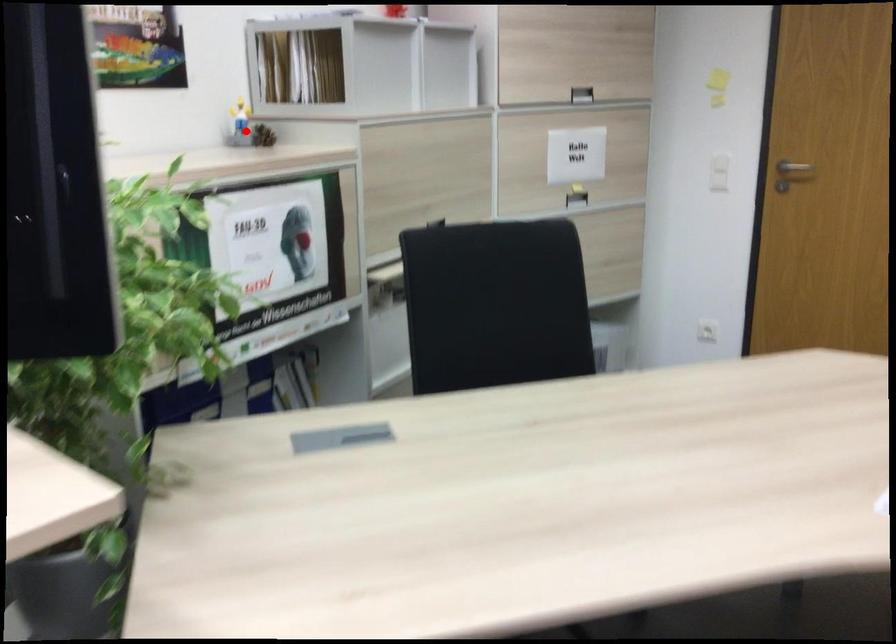
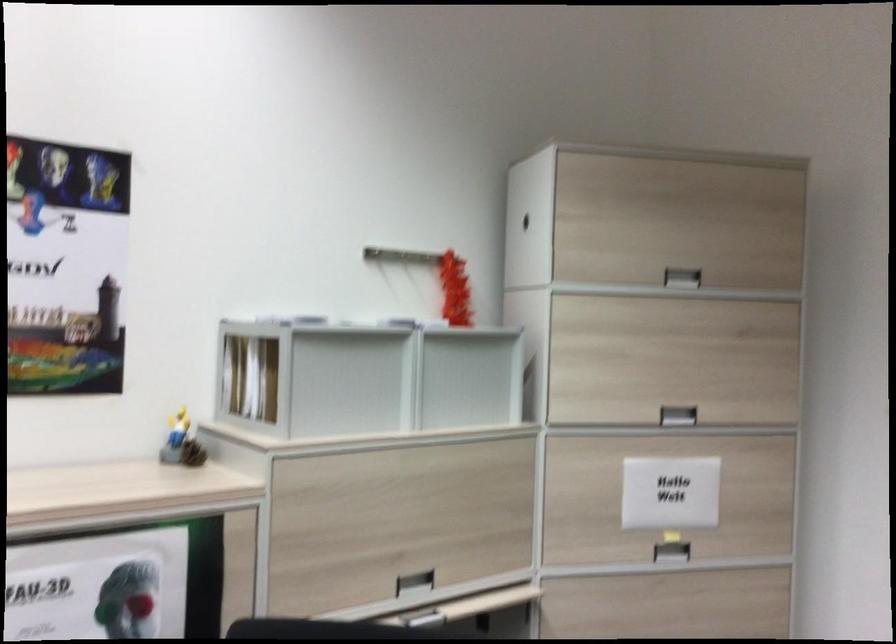
The point at the highlighted location is marked in the first image. Where is the corresponding point in the second image?

(181, 442)